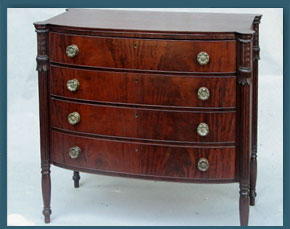
The image size is (290, 229). I want to click on second drawer, so point(139,87).